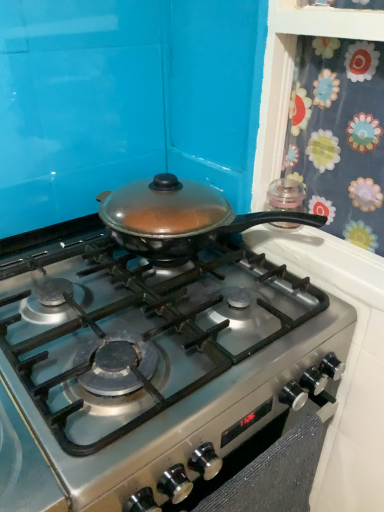
This screenshot has width=384, height=512. I want to click on satin silver gas stove at center, so click(x=140, y=333).

The width and height of the screenshot is (384, 512). What do you see at coordinates (140, 333) in the screenshot? I see `satin silver gas stove at center` at bounding box center [140, 333].

Find the location of `satin silver gas stove at center`. satin silver gas stove at center is located at coordinates (140, 333).